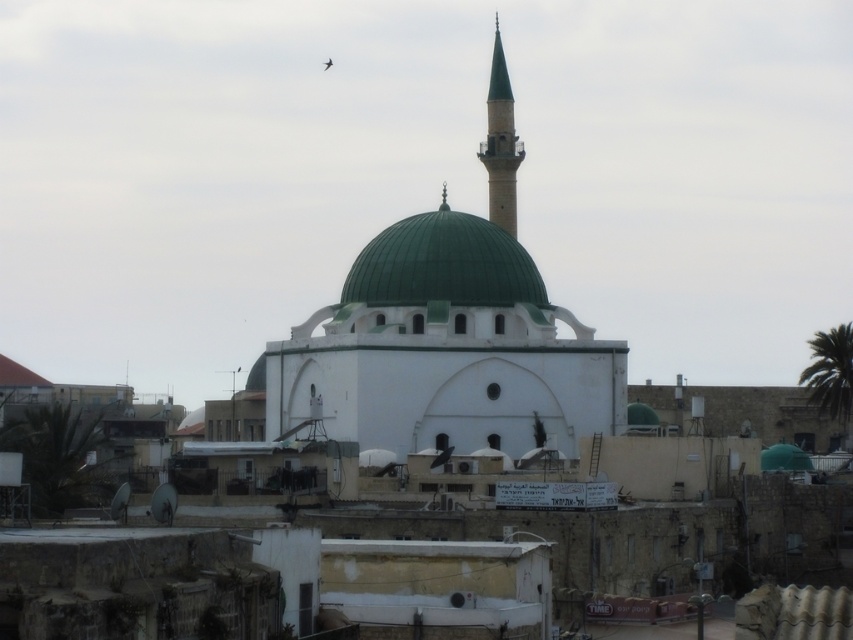
You are a drone operator trying to capture aerial footage of the green matte dome at center. Given that the drone can only hover at coordinates within a radius of 0.1 units from the dome, what are the minimum and maximum x and y coordinates the drone can maintain to stay within range?

The green matte dome at center is located at point (444,264). To stay within the 0.1 radius, the drone must maintain coordinates between x 0.314 and 0.514, and y 0.421 and 0.621.

You are an architect analyzing the mosque structure. You need to determine the spatial relationship between the green matte dome at center and the green glazed minaret at upper center. Which one is positioned higher in the image?

The green glazed minaret at upper center is positioned higher than the green matte dome at center in the image.

You are a city planner assessing the height of structures in the area. Given the mosque has a green matte dome at center and a green glazed minaret at upper center, which one is taller?

The green glazed minaret at upper center is taller than the green matte dome at center.